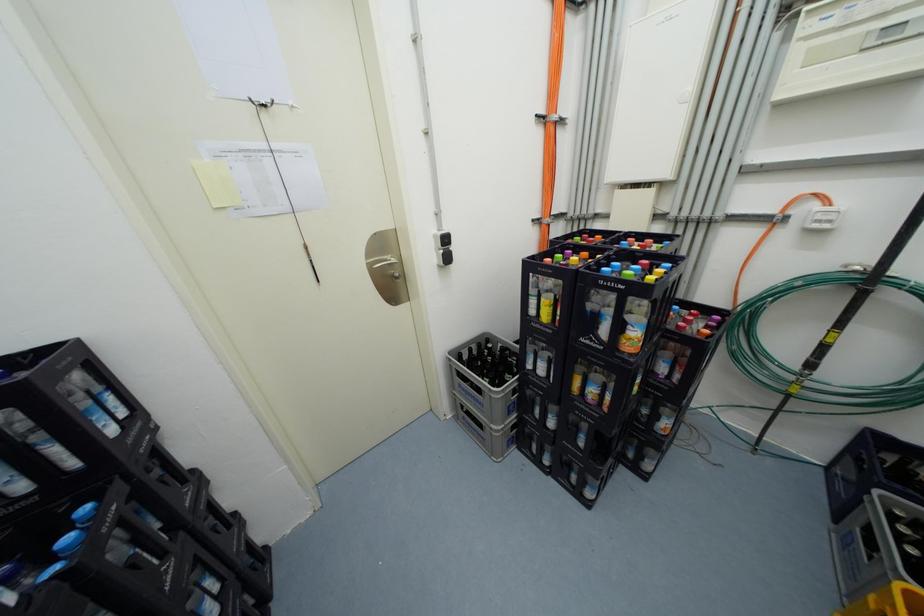
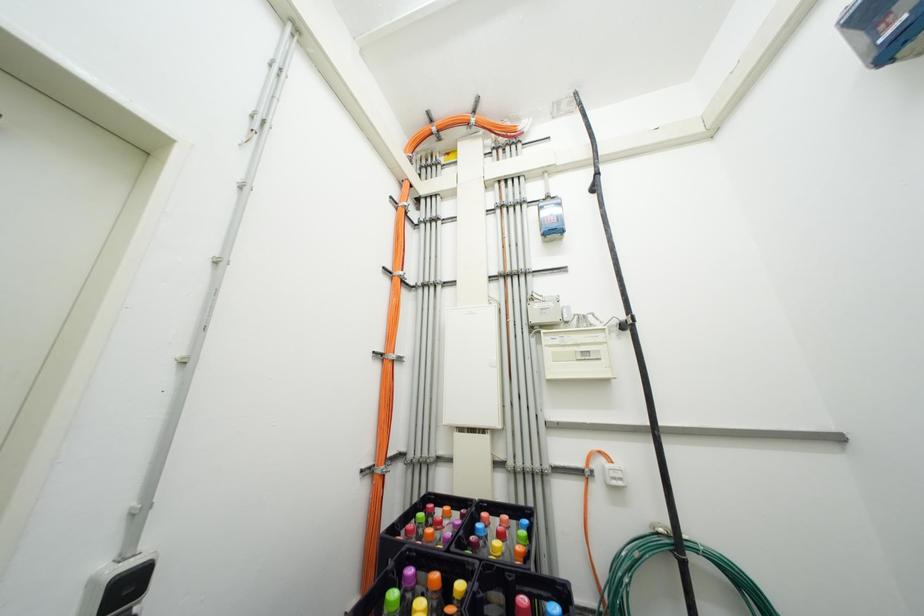
How did the camera likely rotate?

The camera's rotation is toward right-up.